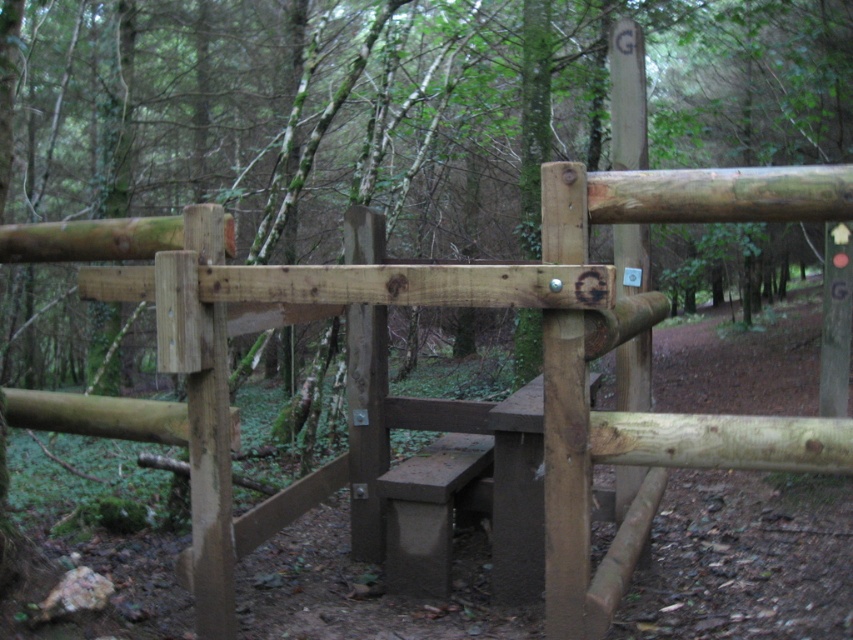
Can you confirm if natural wood gate at center is positioned to the right of concrete bench at center?

Indeed, natural wood gate at center is positioned on the right side of concrete bench at center.

Measure the distance from natural wood gate at center to concrete bench at center.

natural wood gate at center is 83.52 centimeters away from concrete bench at center.

I want to click on natural wood gate at center, so click(543, 355).

Identify the location of natural wood gate at center. This screenshot has height=640, width=853. (543, 355).

Between natural wood fence at center and concrete bench at center, which one appears on the right side from the viewer's perspective?

Positioned to the right is concrete bench at center.

Who is more distant from viewer, (241, 253) or (395, 481)?

The point (241, 253) is more distant.

What do you see at coordinates (405, 108) in the screenshot? This screenshot has height=640, width=853. I see `natural wood fence at center` at bounding box center [405, 108].

Image resolution: width=853 pixels, height=640 pixels. What are the coordinates of `natural wood fence at center` in the screenshot? It's located at (405, 108).

Does natural wood fence at center come in front of natural wood gate at center?

No, it is not.

This screenshot has width=853, height=640. Describe the element at coordinates (405, 108) in the screenshot. I see `natural wood fence at center` at that location.

Where is `natural wood fence at center`? natural wood fence at center is located at coordinates (405, 108).